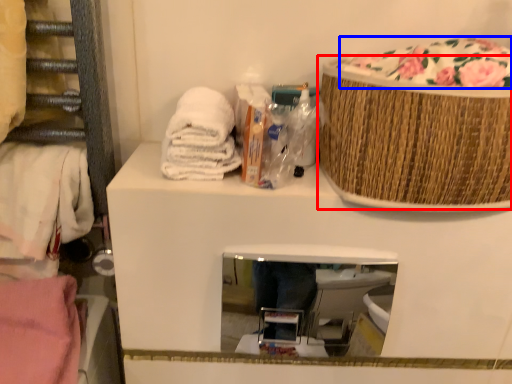
Question: Which of the following is the farthest to the observer, basket (highlighted by a red box) or food (highlighted by a blue box)?

Choices:
 (A) basket
 (B) food

Answer: (B)